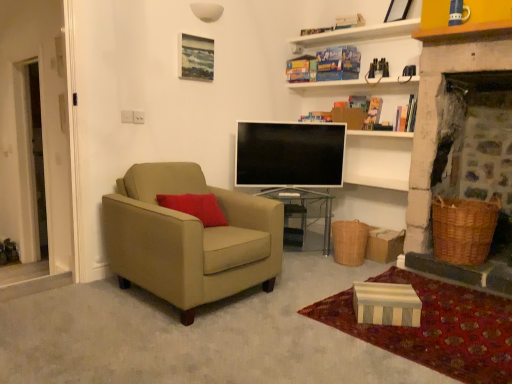
Identify the location of free space in front of suede beige armchair at left. The width and height of the screenshot is (512, 384). (152, 336).